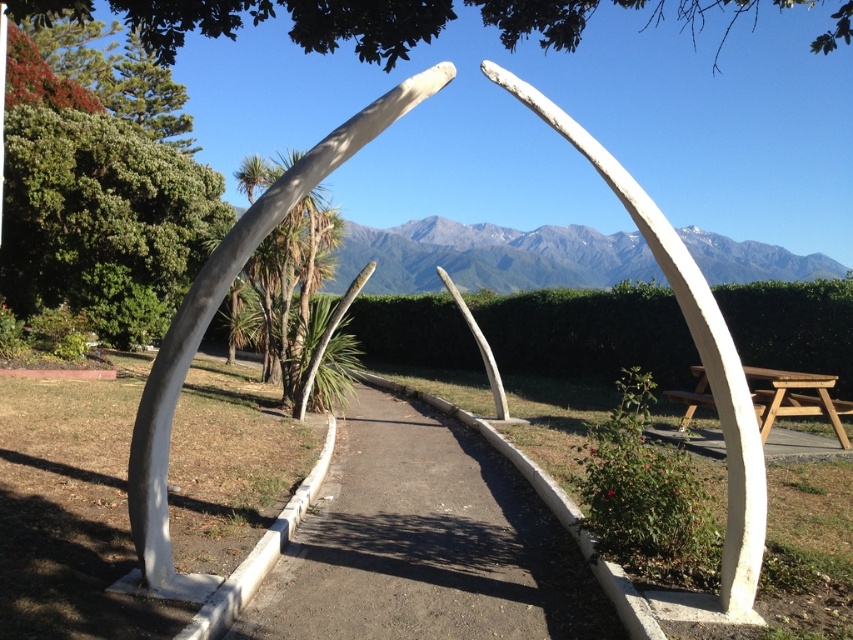
Question: Can you confirm if white matte whalebone at center is thinner than white polished bone at center?

Choices:
 (A) yes
 (B) no

Answer: (B)

Question: Is white polished bone at center positioned behind wooden picnic table at right?

Choices:
 (A) yes
 (B) no

Answer: (B)

Question: Which of the following is the closest to the observer?

Choices:
 (A) wooden picnic table at right
 (B) white matte whalebone at center

Answer: (B)

Question: Does white polished bone at center appear over wooden picnic table at right?

Choices:
 (A) yes
 (B) no

Answer: (A)

Question: Which point is closer to the camera?

Choices:
 (A) white polished bone at center
 (B) white concrete path at center

Answer: (A)

Question: Based on their relative distances, which object is farther from the wooden picnic table at right?

Choices:
 (A) white concrete path at center
 (B) white matte whalebone at center

Answer: (B)